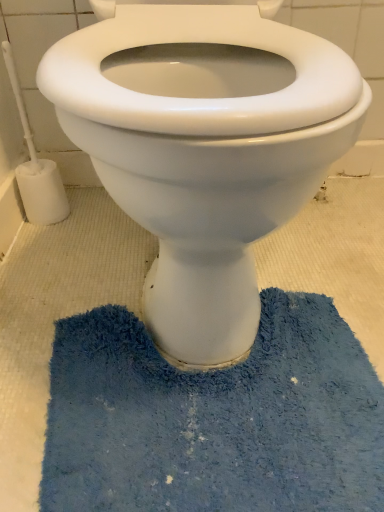
What do you see at coordinates (36, 168) in the screenshot? I see `white plastic toilet brush at left` at bounding box center [36, 168].

In the scene shown: Measure the distance between point (188, 168) and camera.

14.02 inches.

This screenshot has height=512, width=384. What are the coordinates of `white plastic toilet brush at left` in the screenshot? It's located at (36, 168).

Is white plastic toilet brush at left turned away from blue shaggy bath mat at lower center?

No.

Does white plastic toilet brush at left have a lesser width compared to blue shaggy bath mat at lower center?

Correct, the width of white plastic toilet brush at left is less than that of blue shaggy bath mat at lower center.

From the image's perspective, which object appears higher, white plastic toilet brush at left or blue shaggy bath mat at lower center?

white plastic toilet brush at left is shown above in the image.

Is blue shaggy bath mat at lower center looking in the opposite direction of white plastic toilet brush at left?

No, blue shaggy bath mat at lower center's orientation is not away from white plastic toilet brush at left.

Does point (71, 483) appear closer or farther from the camera than point (19, 172)?

Point (71, 483) appears to be closer to the viewer than point (19, 172).

Is blue shaggy bath mat at lower center taller or shorter than white plastic toilet brush at left?

Clearly, blue shaggy bath mat at lower center is shorter compared to white plastic toilet brush at left.

From the image's perspective, which is above, blue shaggy bath mat at lower center or white plastic toilet brush at left?

From the image's view, white plastic toilet brush at left is above.

In the image, is white plastic toilet brush at left on the left side or the right side of white glossy toilet at center?

white plastic toilet brush at left is positioned on white glossy toilet at center's left side.

Does point (7, 70) appear closer or farther from the camera than point (223, 26)?

Point (7, 70) is positioned farther from the camera compared to point (223, 26).

The width and height of the screenshot is (384, 512). Find the location of `toilet on the right of white plastic toilet brush at left`. toilet on the right of white plastic toilet brush at left is located at coordinates (204, 148).

Find the location of a particular element. toilet in front of the white plastic toilet brush at left is located at coordinates (204, 148).

Considering the sizes of objects white glossy toilet at center and white plastic toilet brush at left in the image provided, who is thinner, white glossy toilet at center or white plastic toilet brush at left?

Thinner between the two is white plastic toilet brush at left.

Does white glossy toilet at center turn towards white plastic toilet brush at left?

No, white glossy toilet at center is not turned towards white plastic toilet brush at left.

From the image's perspective, between white glossy toilet at center and white plastic toilet brush at left, who is located below?

white glossy toilet at center is shown below in the image.

Are white glossy toilet at center and blue shaggy bath mat at lower center far apart?

No.

From a real-world perspective, is white glossy toilet at center on blue shaggy bath mat at lower center?

Yes, from a real-world perspective, white glossy toilet at center is above blue shaggy bath mat at lower center.

Is white glossy toilet at center positioned with its back to blue shaggy bath mat at lower center?

No, blue shaggy bath mat at lower center is not at the back of white glossy toilet at center.

Can you confirm if blue shaggy bath mat at lower center is positioned to the left of white glossy toilet at center?

No.

Is white glossy toilet at center surrounded by blue shaggy bath mat at lower center?

No, white glossy toilet at center is not surrounded by blue shaggy bath mat at lower center.

Does blue shaggy bath mat at lower center turn towards white glossy toilet at center?

No.

Is point (184, 379) positioned in front of point (327, 41)?

Yes, point (184, 379) is in front of point (327, 41).

I want to click on brush above the blue shaggy bath mat at lower center (from the image's perspective), so click(36, 168).

Find the location of a particular element. This screenshot has width=384, height=512. brush above the blue shaggy bath mat at lower center (from a real-world perspective) is located at coordinates (36, 168).

Considering their positions, is blue shaggy bath mat at lower center positioned further to white plastic toilet brush at left than white glossy toilet at center?

blue shaggy bath mat at lower center is positioned further to the anchor white plastic toilet brush at left.

Which object lies nearer to the anchor point white glossy toilet at center, white plastic toilet brush at left or blue shaggy bath mat at lower center?

blue shaggy bath mat at lower center lies closer to white glossy toilet at center than the other object.

Estimate the real-world distances between objects in this image. Which object is closer to white glossy toilet at center, blue shaggy bath mat at lower center or white plastic toilet brush at left?

blue shaggy bath mat at lower center lies closer to white glossy toilet at center than the other object.

Which object lies nearer to the anchor point blue shaggy bath mat at lower center, white glossy toilet at center or white plastic toilet brush at left?

white glossy toilet at center lies closer to blue shaggy bath mat at lower center than the other object.

When comparing their distances from blue shaggy bath mat at lower center, does white plastic toilet brush at left or white glossy toilet at center seem closer?

Among the two, white glossy toilet at center is located nearer to blue shaggy bath mat at lower center.

Based on the photo, from the image, which object appears to be farther from white plastic toilet brush at left, white glossy toilet at center or blue shaggy bath mat at lower center?

blue shaggy bath mat at lower center is positioned further to the anchor white plastic toilet brush at left.

Locate an element on the screen. toilet between white plastic toilet brush at left and blue shaggy bath mat at lower center in the vertical direction is located at coordinates (204, 148).